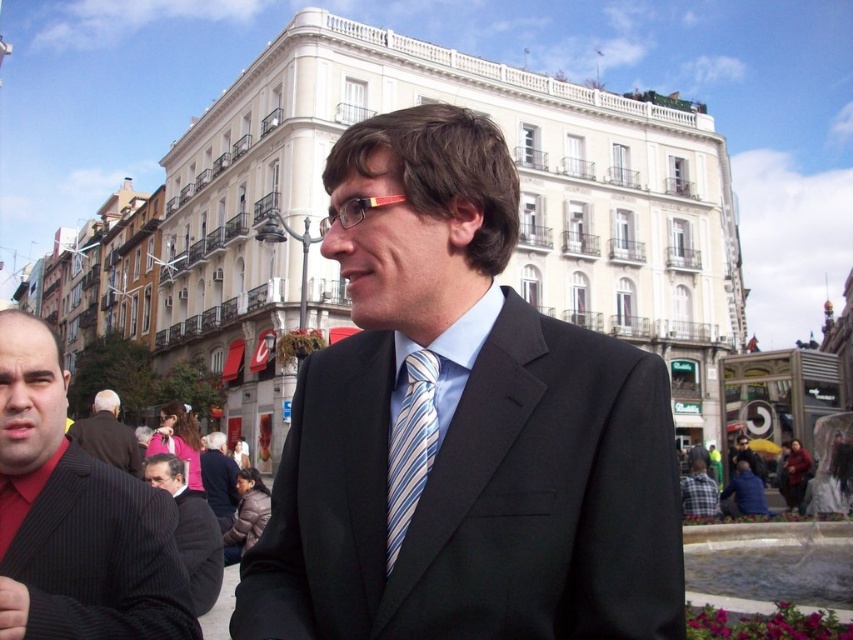
Does plaid fabric shirt at lower right appear on the left side of pink fabric hand at center?

Incorrect, plaid fabric shirt at lower right is not on the left side of pink fabric hand at center.

Between plaid fabric shirt at lower right and pink fabric hand at center, which one appears on the right side from the viewer's perspective?

plaid fabric shirt at lower right is more to the right.

Is point (695, 509) closer to viewer compared to point (160, 433)?

Yes, point (695, 509) is in front of point (160, 433).

Locate an element on the screen. The image size is (853, 640). plaid fabric shirt at lower right is located at coordinates (699, 492).

Consider the image. Can you confirm if dark gray pinstripe suit at lower left is positioned above pink fabric hand at center?

No.

The width and height of the screenshot is (853, 640). Describe the element at coordinates (190, 529) in the screenshot. I see `dark gray pinstripe suit at lower left` at that location.

Is point (192, 544) less distant than point (167, 429)?

Yes, point (192, 544) is in front of point (167, 429).

At what (x,y) coordinates should I click in order to perform the action: click on dark gray pinstripe suit at lower left. Please return your answer as a coordinate pair (x, y). The height and width of the screenshot is (640, 853). Looking at the image, I should click on (190, 529).

Does dark gray pinstripe suit at lower left have a smaller size compared to striped fabric suit at center?

No, dark gray pinstripe suit at lower left is not smaller than striped fabric suit at center.

This screenshot has height=640, width=853. In order to click on dark gray pinstripe suit at lower left in this screenshot , I will do coord(190,529).